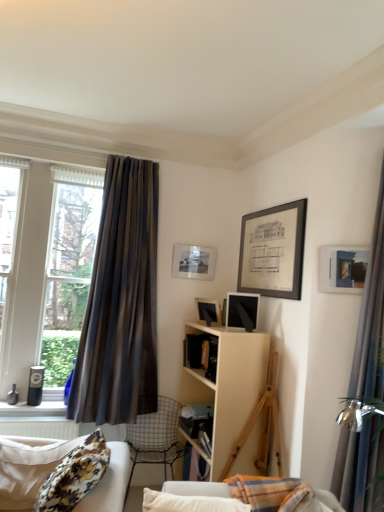
Measure the distance between point [156,247] and camera.

They are 12.39 feet apart.

How much space does matte blue picture frame at upper right, which appears as the 3th picture frame when viewed from the back, occupy vertically?

matte blue picture frame at upper right, which appears as the 3th picture frame when viewed from the back, is 12.13 inches tall.

What do you see at coordinates (371, 317) in the screenshot? I see `silky blue curtain at right, acting as the second curtain starting from the back` at bounding box center [371, 317].

How much space does silky blue curtain at right, acting as the second curtain starting from the back, occupy horizontally?

silky blue curtain at right, acting as the second curtain starting from the back, is 25.17 centimeters wide.

The height and width of the screenshot is (512, 384). What do you see at coordinates (193, 262) in the screenshot?
I see `matte glass picture frame at upper center, positioned as the 3th picture frame in front-to-back order` at bounding box center [193, 262].

The image size is (384, 512). I want to click on beige wood shelf at center, so click(x=228, y=385).

Find the location of a particular element. Image resolution: width=384 pixels, height=512 pixels. brown striped curtain at left, the 1th curtain in the left-to-right sequence is located at coordinates (121, 302).

From a real-world perspective, is matte blue picture frame at upper right, which appears as the 3th picture frame when viewed from the back, beneath matte glass picture frame at upper center, the 1th picture frame from the left?

Yes, from a real-world perspective, matte blue picture frame at upper right, which appears as the 3th picture frame when viewed from the back, is below matte glass picture frame at upper center, the 1th picture frame from the left.

Is matte blue picture frame at upper right, which appears as the 3th picture frame when viewed from the back, placed right next to matte glass picture frame at upper center, the 1th picture frame from the left?

No.

Considering the points (322, 251) and (194, 273), which point is in front, point (322, 251) or point (194, 273)?

The point (322, 251) is in front.

Locate an element on the screen. The image size is (384, 512). the 2nd curtain above the beige wood shelf at center (from the image's perspective) is located at coordinates point(121,302).

Does point (144, 368) come behind point (260, 352)?

Yes, it is behind point (260, 352).

How different are the orientations of brown striped curtain at left, which ranks as the 2th curtain in right-to-left order, and beige wood shelf at center in degrees?

There is a 86.7-degree angle between the facing directions of brown striped curtain at left, which ranks as the 2th curtain in right-to-left order, and beige wood shelf at center.

Is floral fabric studio couch at lower left at the back of clear glass window at left?

clear glass window at left does not have its back to floral fabric studio couch at lower left.

From their relative heights in the image, would you say clear glass window at left is taller or shorter than floral fabric studio couch at lower left?

Considering their sizes, clear glass window at left has more height than floral fabric studio couch at lower left.

Which of these two, clear glass window at left or floral fabric studio couch at lower left, is wider?

With larger width is clear glass window at left.

From the image's perspective, between clear glass window at left and floral fabric studio couch at lower left, which one is located above?

clear glass window at left is shown above in the image.

Which object is thinner, matte black speaker at left or matte black picture frame at center, which is counted as the second picture frame, starting from the back?

Thinner between the two is matte black speaker at left.

From a real-world perspective, which is physically below, matte black speaker at left or matte black picture frame at center, which is counted as the second picture frame, starting from the back?

matte black speaker at left is physically lower.

Based on the photo, which point is more forward, [38,391] or [204,318]?

The point [38,391] is closer.

In the scene shown: Considering the relative positions of matte black speaker at left and matte black picture frame at center, positioned as the second picture frame in front-to-back order, in the image provided, is matte black speaker at left behind matte black picture frame at center, positioned as the second picture frame in front-to-back order,?

Yes, the depth of matte black speaker at left is greater than that of matte black picture frame at center, positioned as the second picture frame in front-to-back order.

From the image's perspective, does clear glass window at left appear lower than matte blue picture frame at upper right, marked as the 3th picture frame in a left-to-right arrangement?

Yes, from the image's perspective, clear glass window at left is below matte blue picture frame at upper right, marked as the 3th picture frame in a left-to-right arrangement.

Considering the sizes of clear glass window at left and matte blue picture frame at upper right, acting as the first picture frame starting from the right, in the image, is clear glass window at left taller or shorter than matte blue picture frame at upper right, acting as the first picture frame starting from the right,?

In the image, clear glass window at left appears to be taller than matte blue picture frame at upper right, acting as the first picture frame starting from the right.

Based on the photo, which of these two, clear glass window at left or matte blue picture frame at upper right, acting as the first picture frame starting from the right, is smaller?

Smaller between the two is matte blue picture frame at upper right, acting as the first picture frame starting from the right.

Is clear glass window at left closer to camera compared to matte blue picture frame at upper right, which appears as the 3th picture frame when viewed from the back?

No, clear glass window at left is further to the viewer.

Is matte blue picture frame at upper right, which appears as the 3th picture frame when viewed from the back, completely or partially outside of floral fabric studio couch at lower left?

Yes, matte blue picture frame at upper right, which appears as the 3th picture frame when viewed from the back, is not within floral fabric studio couch at lower left.

Consider the image. From a real-world perspective, is matte blue picture frame at upper right, which appears as the 3th picture frame when viewed from the back, located higher than floral fabric studio couch at lower left?

Yes, from a real-world perspective, matte blue picture frame at upper right, which appears as the 3th picture frame when viewed from the back, is over floral fabric studio couch at lower left

Is matte blue picture frame at upper right, marked as the 3th picture frame in a left-to-right arrangement, closer to camera compared to floral fabric studio couch at lower left?

No, matte blue picture frame at upper right, marked as the 3th picture frame in a left-to-right arrangement, is further to the viewer.

Measure the distance from matte blue picture frame at upper right, marked as the 3th picture frame in a left-to-right arrangement, to floral fabric studio couch at lower left.

matte blue picture frame at upper right, marked as the 3th picture frame in a left-to-right arrangement, and floral fabric studio couch at lower left are 1.81 meters apart.

Would you say floral fabric studio couch at lower left is to the left or to the right of metallic wire chair at lower center in the picture?

Clearly, floral fabric studio couch at lower left is on the left of metallic wire chair at lower center in the image.

Which object is wider, floral fabric studio couch at lower left or metallic wire chair at lower center?

Wider between the two is metallic wire chair at lower center.

Is there a large distance between floral fabric studio couch at lower left and metallic wire chair at lower center?

Yes, floral fabric studio couch at lower left and metallic wire chair at lower center are located far from each other.

Is floral fabric studio couch at lower left situated inside metallic wire chair at lower center or outside?

floral fabric studio couch at lower left is located beyond the bounds of metallic wire chair at lower center.

Identify the location of picture frame above the matte blue picture frame at upper right, marked as the 3th picture frame in a left-to-right arrangement (from the image's perspective). The width and height of the screenshot is (384, 512). (193, 262).

The height and width of the screenshot is (512, 384). What are the coordinates of `shelf that is below the brown striped curtain at left, the 1th curtain in the left-to-right sequence (from the image's perspective)` in the screenshot? It's located at (228, 385).

From the image, which object appears to be nearer to matte glass picture frame at upper center, placed as the third picture frame when sorted from right to left, clear glass window at left or silky blue curtain at right, acting as the second curtain starting from the back?

Based on the image, clear glass window at left appears to be nearer to matte glass picture frame at upper center, placed as the third picture frame when sorted from right to left.

Estimate the real-world distances between objects in this image. Which object is further from brown striped curtain at left, the 1th curtain in the left-to-right sequence, beige wood shelf at center or floral fabric studio couch at lower left?

floral fabric studio couch at lower left is positioned further to the anchor brown striped curtain at left, the 1th curtain in the left-to-right sequence.

Based on their spatial positions, is clear glass window at left or metallic wire chair at lower center further from floral fabric studio couch at lower left?

clear glass window at left is positioned further to the anchor floral fabric studio couch at lower left.

Considering their positions, is matte blue picture frame at upper right, positioned as the 1th picture frame in front-to-back order, positioned further to metallic wire chair at lower center than clear glass window at left?

matte blue picture frame at upper right, positioned as the 1th picture frame in front-to-back order, is further to metallic wire chair at lower center.

Which object lies nearer to the anchor point silky blue curtain at right, the second curtain from the left, clear glass window at left or beige wood shelf at center?

Among the two, beige wood shelf at center is located nearer to silky blue curtain at right, the second curtain from the left.

Which object lies further to the anchor point brown striped curtain at left, which ranks as the 2th curtain in right-to-left order, matte black picture frame at center, positioned as the second picture frame in front-to-back order, or clear glass window at left?

matte black picture frame at center, positioned as the second picture frame in front-to-back order.

Considering their positions, is floral fabric studio couch at lower left positioned further to silky blue curtain at right, the first curtain viewed from the right, than beige wood shelf at center?

The object further to silky blue curtain at right, the first curtain viewed from the right, is floral fabric studio couch at lower left.

From the image, which object appears to be farther from metallic wire chair at lower center, clear glass window at left or silky blue curtain at right, acting as the second curtain starting from the back?

Based on the image, silky blue curtain at right, acting as the second curtain starting from the back, appears to be further to metallic wire chair at lower center.

This screenshot has height=512, width=384. Find the location of `curtain between matte black speaker at left and silky blue curtain at right, acting as the second curtain starting from the back, from left to right`. curtain between matte black speaker at left and silky blue curtain at right, acting as the second curtain starting from the back, from left to right is located at coordinates (121, 302).

Identify the location of shelf located between metallic wire chair at lower center and silky blue curtain at right, the first curtain viewed from the right, in the left-right direction. (228, 385).

Where is `speaker situated between clear glass window at left and silky blue curtain at right, acting as the second curtain starting from the back, from left to right`? speaker situated between clear glass window at left and silky blue curtain at right, acting as the second curtain starting from the back, from left to right is located at coordinates (35, 385).

The width and height of the screenshot is (384, 512). What are the coordinates of `studio couch situated between clear glass window at left and beige wood shelf at center from left to right` in the screenshot? It's located at 28,467.